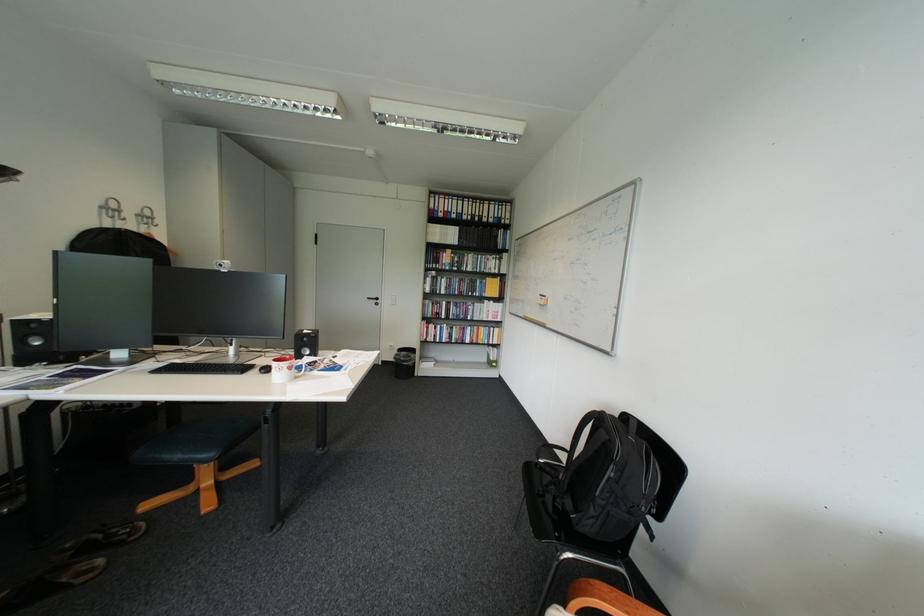
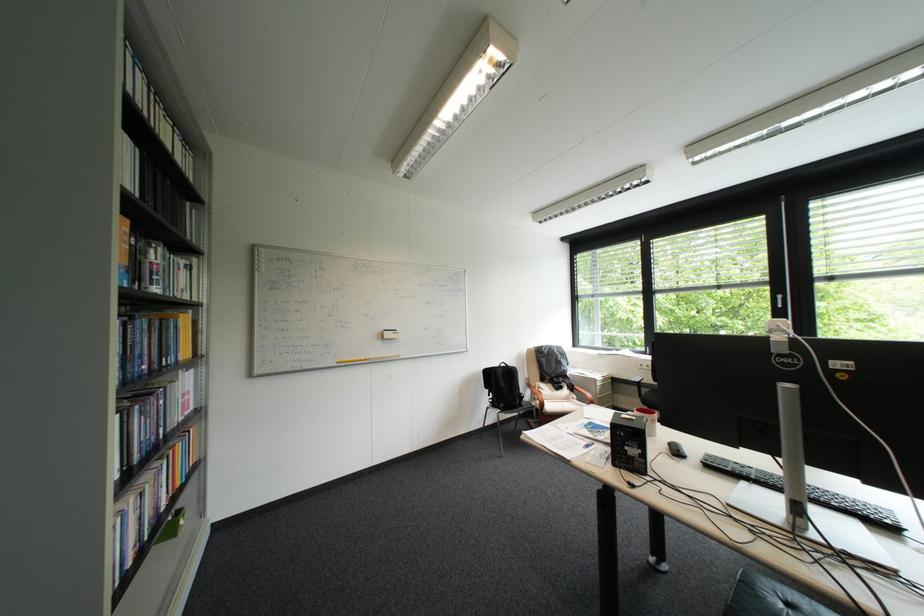
In the second image, find the point that corresponds to (553,296) in the first image.

(397, 331)